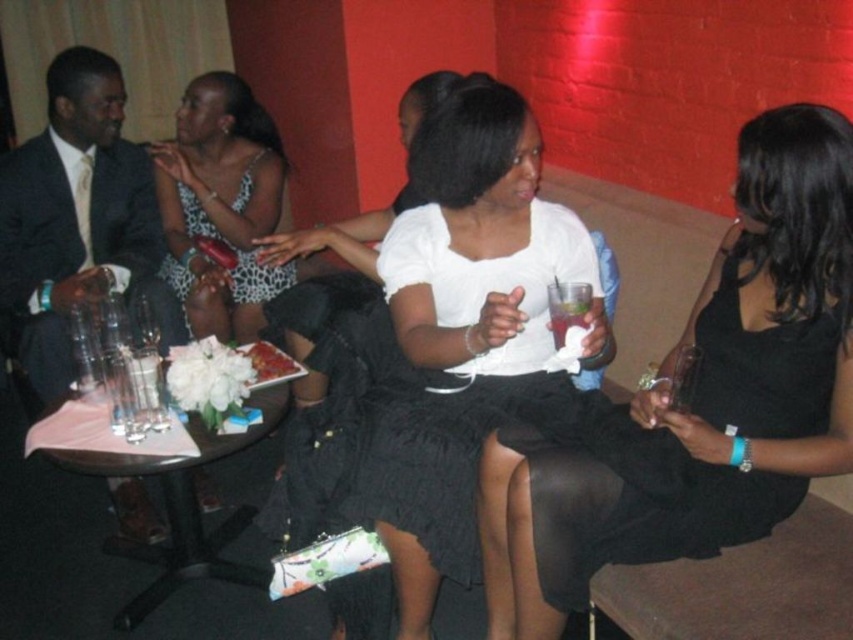
You are standing in the lounge and want to hand a drink to the person wearing the matte white blouse at center. Based on the coordinates provided, in which direction should you move relative to the couch to reach them?

The matte white blouse at center is located at coordinates point (699, 400). Since the couch is in the foreground with the central figure, you should move towards the center of the couch area to reach them.

You are at a party and want to take a photo of both the white matte dress at center and the leopard print fabric dress at center. Can you see both dresses clearly in the photo without any obstruction?

The white matte dress at center is in front of the leopard print fabric dress at center, so the leopard print fabric dress at center may be partially obscured in the photo.